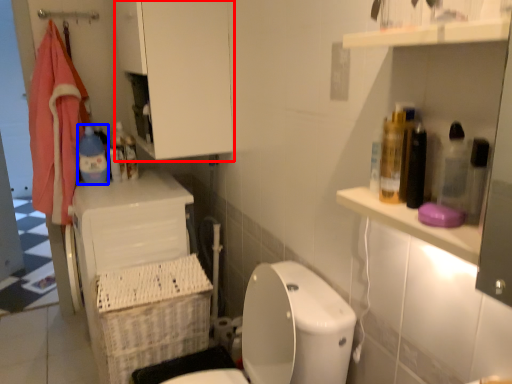
Question: Among these objects, which one is nearest to the camera, cabinetry (highlighted by a red box) or cleaning product (highlighted by a blue box)?

Choices:
 (A) cabinetry
 (B) cleaning product

Answer: (A)